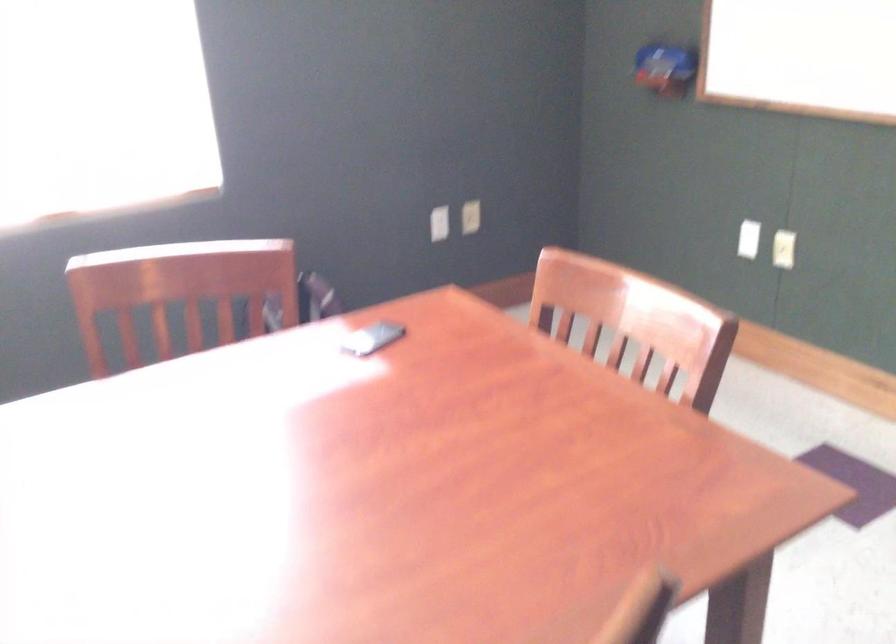
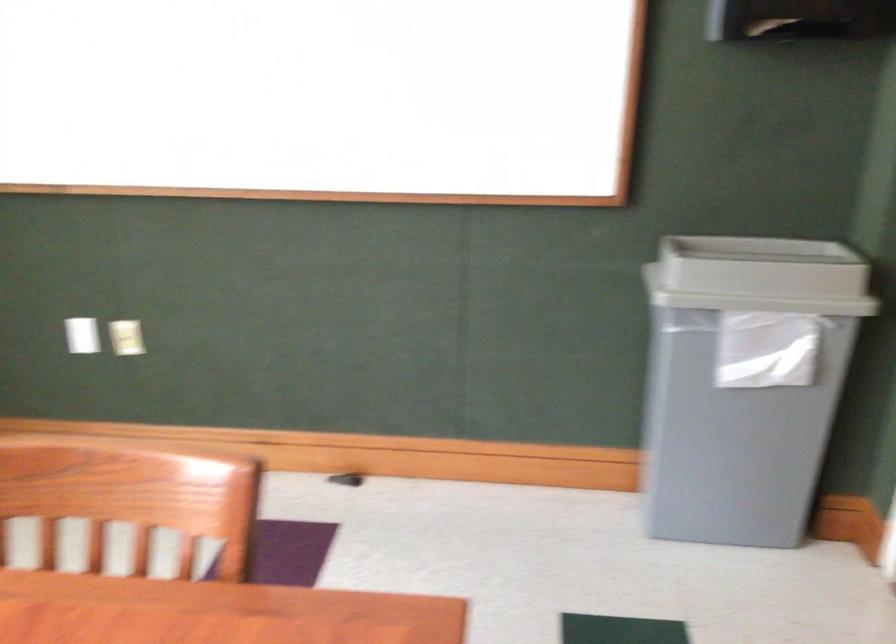
Question: The images are taken continuously from a first-person perspective. In which direction is your viewpoint rotating?

Choices:
 (A) Left
 (B) Right
 (C) Up
 (D) Down

Answer: (B)